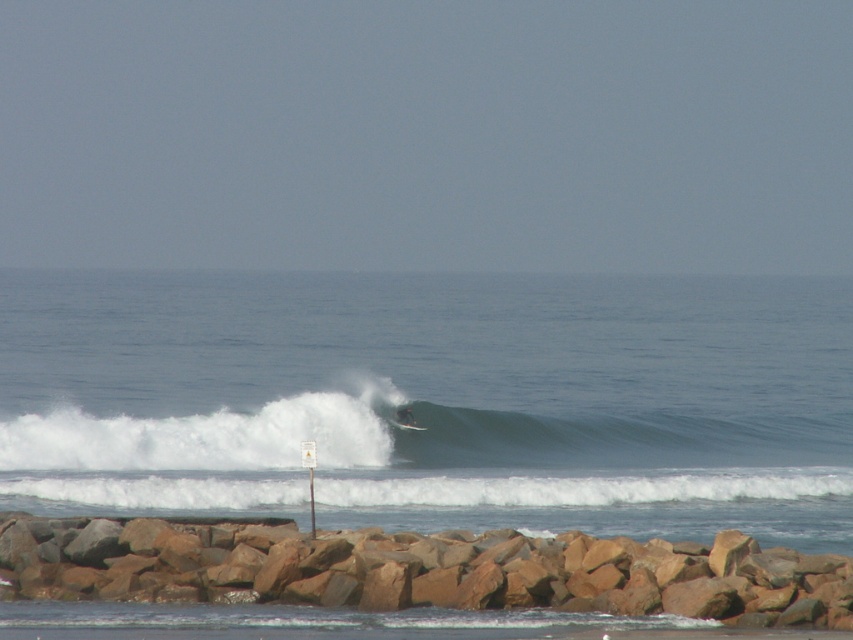
Question: Is brown rock at lower center in front of white foam wave at center?

Choices:
 (A) no
 (B) yes

Answer: (B)

Question: Which object is closer to the camera taking this photo?

Choices:
 (A) brown rock at lower center
 (B) white frothy water at center
 (C) white foam wave at center

Answer: (A)

Question: Based on their relative distances, which object is farther from the brown rock at lower center?

Choices:
 (A) white foam wave at center
 (B) white frothy water at center
 (C) white foam surfboard at center

Answer: (B)

Question: Which object appears farthest from the camera in this image?

Choices:
 (A) brown rock at lower center
 (B) white frothy water at center
 (C) white foam surfboard at center

Answer: (C)

Question: Is white frothy water at center above white foam surfboard at center?

Choices:
 (A) yes
 (B) no

Answer: (A)

Question: Is white frothy water at center closer to camera compared to brown rock at lower center?

Choices:
 (A) yes
 (B) no

Answer: (B)